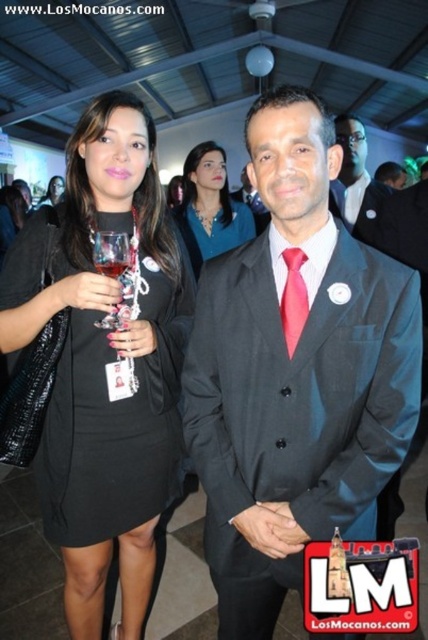
Question: Which object is closer to the camera taking this photo?

Choices:
 (A) transparent glass at center
 (B) matte black dress at center
 (C) clear glass wine at center

Answer: (A)

Question: Where is black satin suit at center located in relation to red satin tie at center in the image?

Choices:
 (A) above
 (B) below

Answer: (B)

Question: Which object appears farthest from the camera in this image?

Choices:
 (A) black satin suit at center
 (B) red satin tie at center
 (C) transparent glass at center

Answer: (C)

Question: Which is farther from the transparent glass at center?

Choices:
 (A) clear glass wine at center
 (B) red satin tie at center
 (C) matte black suit at center
 (D) black matte dress at center

Answer: (C)

Question: Is black matte dress at center closer to camera compared to transparent glass at center?

Choices:
 (A) no
 (B) yes

Answer: (A)

Question: In this image, where is matte blue dress at center located relative to transparent glass at center?

Choices:
 (A) below
 (B) above

Answer: (B)